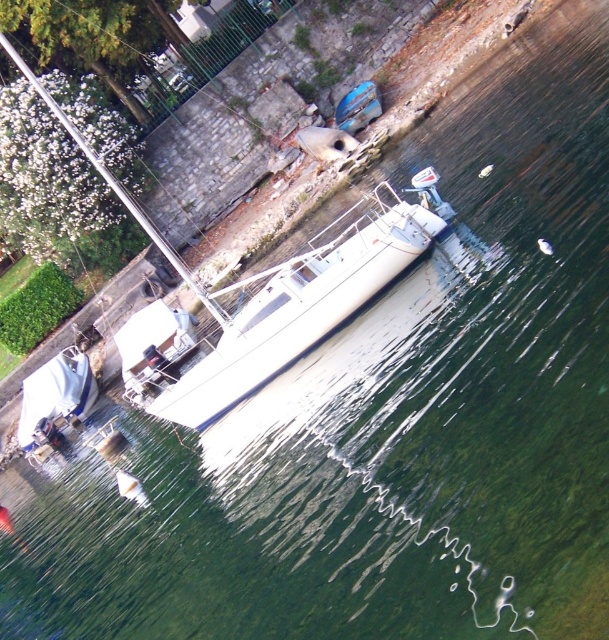
Question: Which of the following is the closest to the observer?

Choices:
 (A) blue glossy surfboard at upper center
 (B) white glossy sailboat at center

Answer: (B)

Question: Considering the relative positions of white glossy boat at lower left and blue glossy surfboard at upper center in the image provided, where is white glossy boat at lower left located with respect to blue glossy surfboard at upper center?

Choices:
 (A) right
 (B) left

Answer: (B)

Question: Among these points, which one is nearest to the camera?

Choices:
 (A) (69, 387)
 (B) (146, 355)
 (C) (97, 163)
 (D) (364, 122)

Answer: (C)

Question: Does white glossy boat at center have a larger size compared to blue glossy surfboard at upper center?

Choices:
 (A) yes
 (B) no

Answer: (A)

Question: Which object appears farthest from the camera in this image?

Choices:
 (A) white glossy sailboat at center
 (B) blue glossy surfboard at upper center
 (C) white glossy boat at center
 (D) white glossy boat at lower left

Answer: (B)

Question: Can you confirm if white glossy boat at center is positioned above blue glossy surfboard at upper center?

Choices:
 (A) no
 (B) yes

Answer: (A)